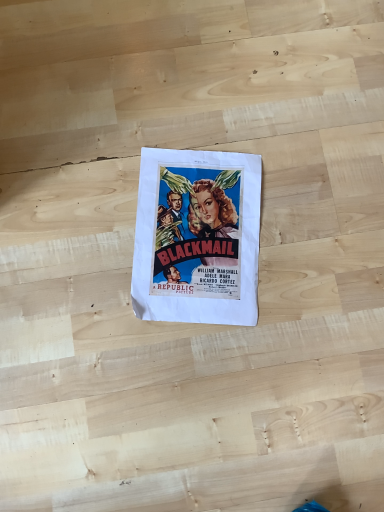
The width and height of the screenshot is (384, 512). Identify the location of empty space that is ontop of matte paper poster at center (from a real-world perspective). (201, 232).